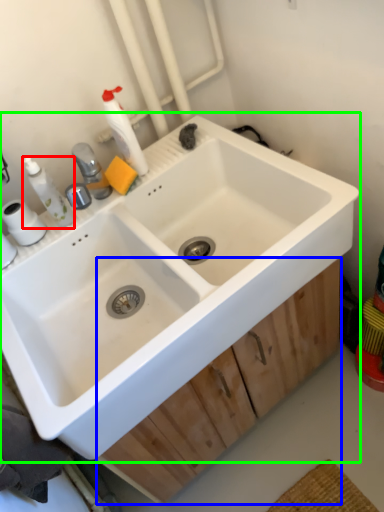
Question: Based on their relative distances, which object is nearer to toiletry (highlighted by a red box)? Choose from drawer (highlighted by a blue box) and sink (highlighted by a green box).

Choices:
 (A) drawer
 (B) sink

Answer: (B)